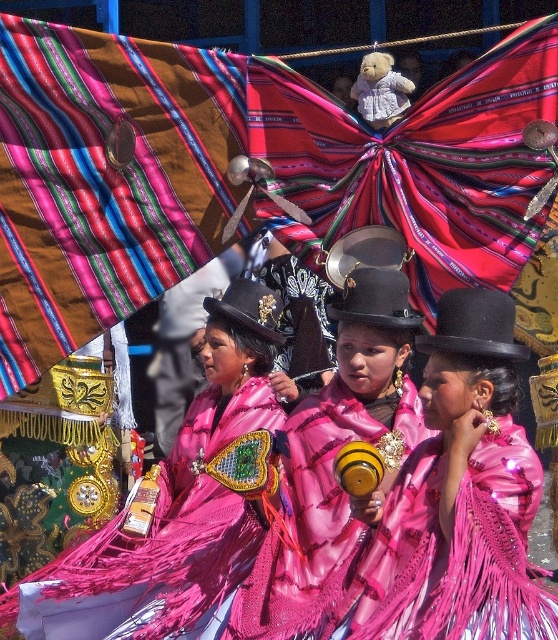
Question: Can you confirm if shiny pink dress at center is positioned to the left of shiny pink fabric at center?

Choices:
 (A) yes
 (B) no

Answer: (B)

Question: Does shiny pink fabric at center appear on the left side of pink satin maraca at center?

Choices:
 (A) no
 (B) yes

Answer: (B)

Question: Which of the following is the closest to the observer?

Choices:
 (A) (458, 490)
 (B) (290, 464)
 (C) (86, 572)
 (D) (535, 497)

Answer: (A)

Question: Considering the relative positions of pink satin maracas at center and shiny pink dress at center in the image provided, where is pink satin maracas at center located with respect to shiny pink dress at center?

Choices:
 (A) below
 (B) above

Answer: (A)

Question: Among these points, which one is nearest to the camera?

Choices:
 (A) (194, 481)
 (B) (513, 634)

Answer: (B)

Question: Which object is closer to the camera taking this photo?

Choices:
 (A) shiny pink dress at center
 (B) shiny pink fabric at center
 (C) pink satin maraca at center
 (D) pink satin maracas at center

Answer: (A)